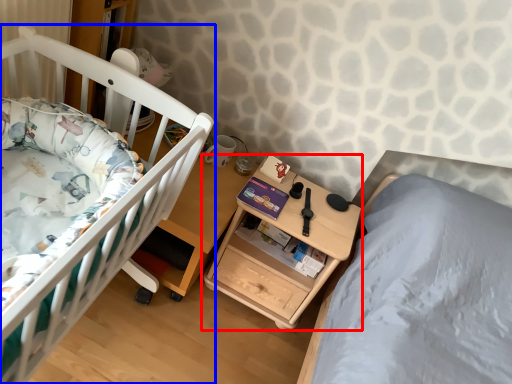
Question: Which object is closer to the camera taking this photo, nightstand (highlighted by a red box) or infant bed (highlighted by a blue box)?

Choices:
 (A) nightstand
 (B) infant bed

Answer: (B)